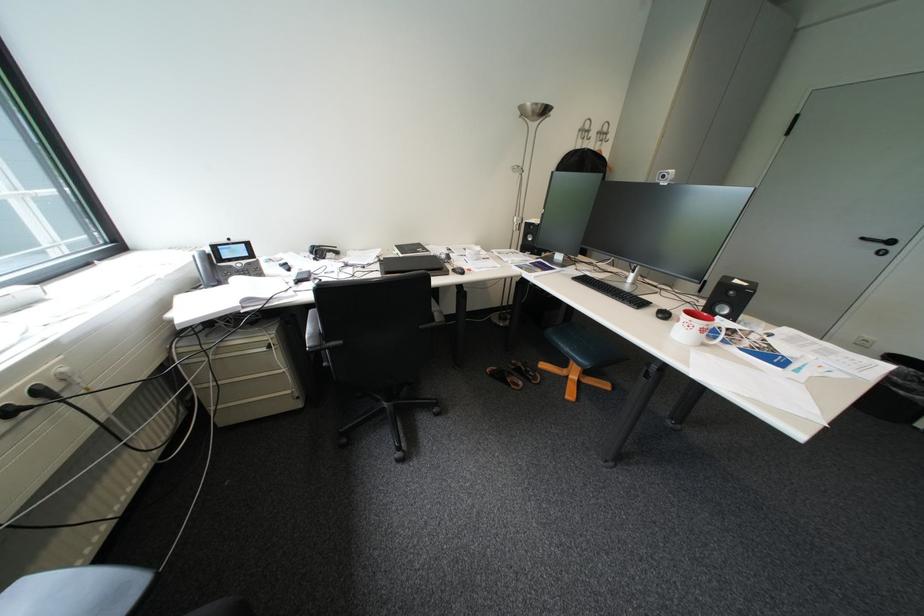
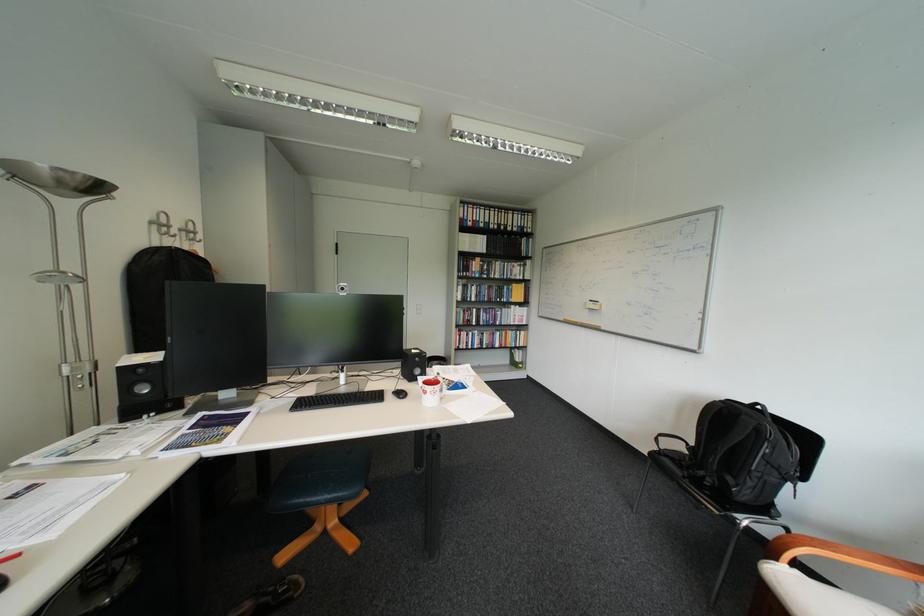
The point at (736, 317) is marked in the first image. Where is the corresponding point in the second image?

(432, 376)